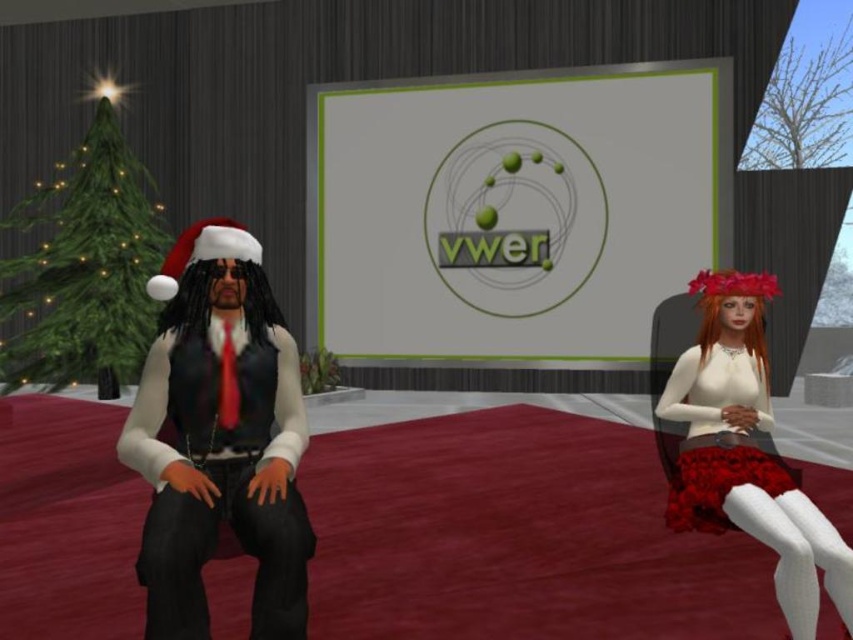
Question: Which point is farther to the camera?

Choices:
 (A) (751, 285)
 (B) (776, 496)

Answer: (A)

Question: From the image, what is the correct spatial relationship of black denim jeans at center in relation to velvet red dress at right?

Choices:
 (A) right
 (B) left

Answer: (B)

Question: Among these objects, which one is nearest to the camera?

Choices:
 (A) black denim jeans at center
 (B) matte black vest at center
 (C) green matte christmas tree at left

Answer: (A)

Question: Can you confirm if velvet red skirt at right is positioned to the right of velvet red dress at right?

Choices:
 (A) no
 (B) yes

Answer: (B)

Question: Is matte black vest at center further to camera compared to velvet red dress at right?

Choices:
 (A) no
 (B) yes

Answer: (A)

Question: Which of the following is the farthest from the observer?

Choices:
 (A) (125, 147)
 (B) (712, 452)

Answer: (A)